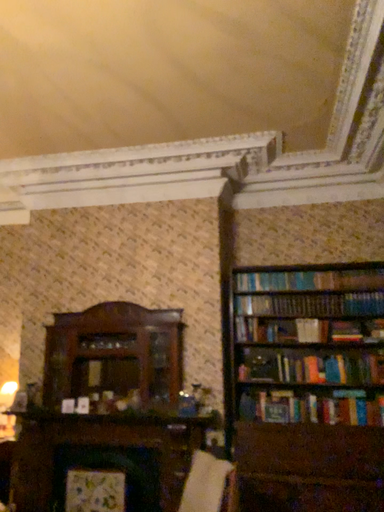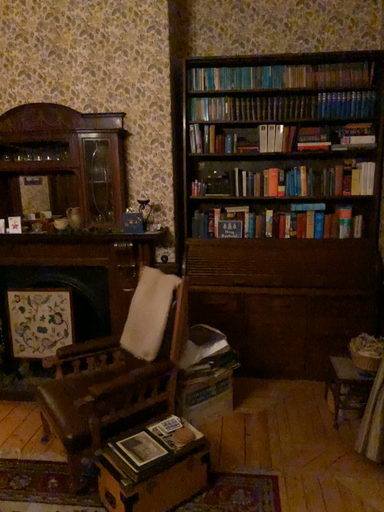
Question: Which way did the camera rotate in the video?

Choices:
 (A) rotated upward
 (B) rotated downward

Answer: (B)